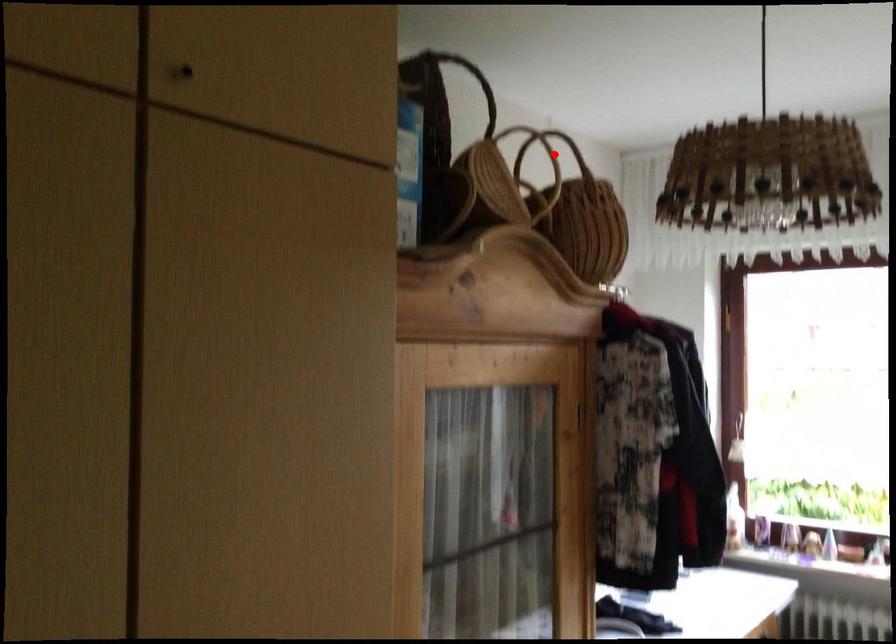
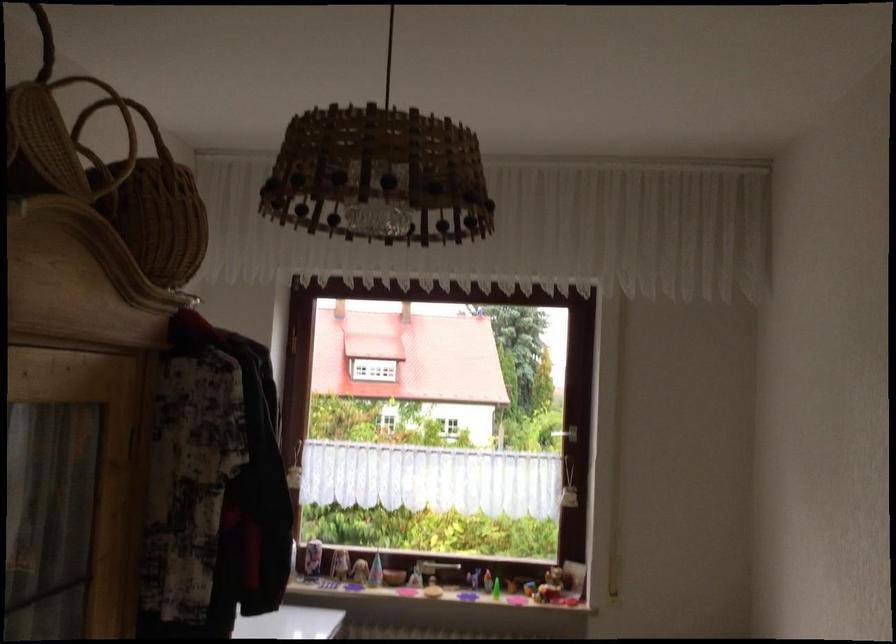
The point at the highlighted location is marked in the first image. Where is the corresponding point in the second image?

(128, 122)